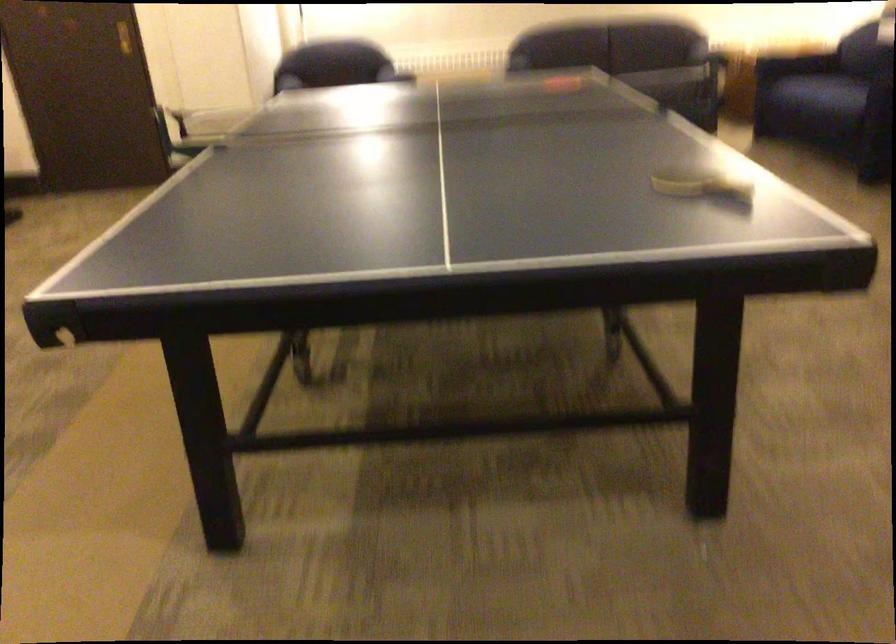
This screenshot has height=644, width=896. I want to click on ping-pong paddle, so click(701, 184).